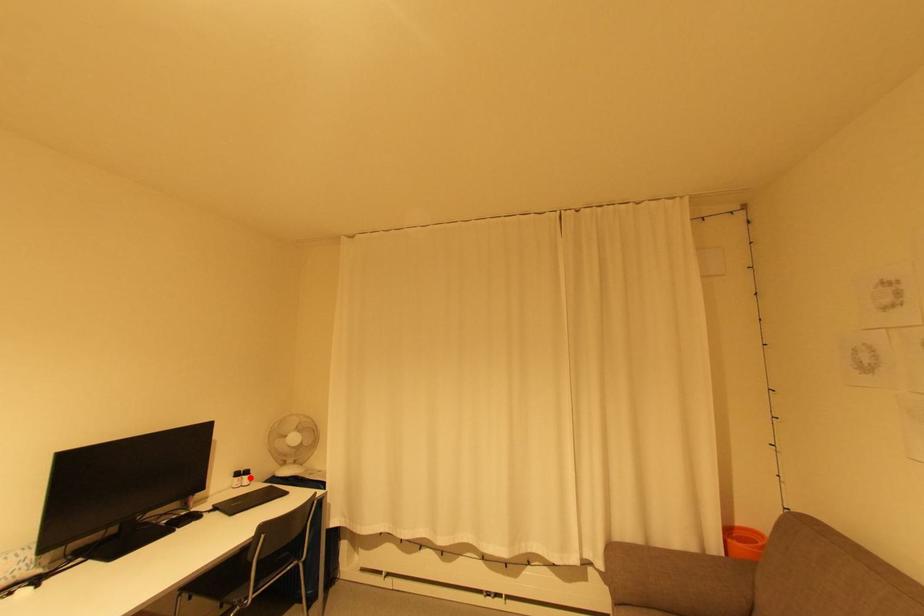
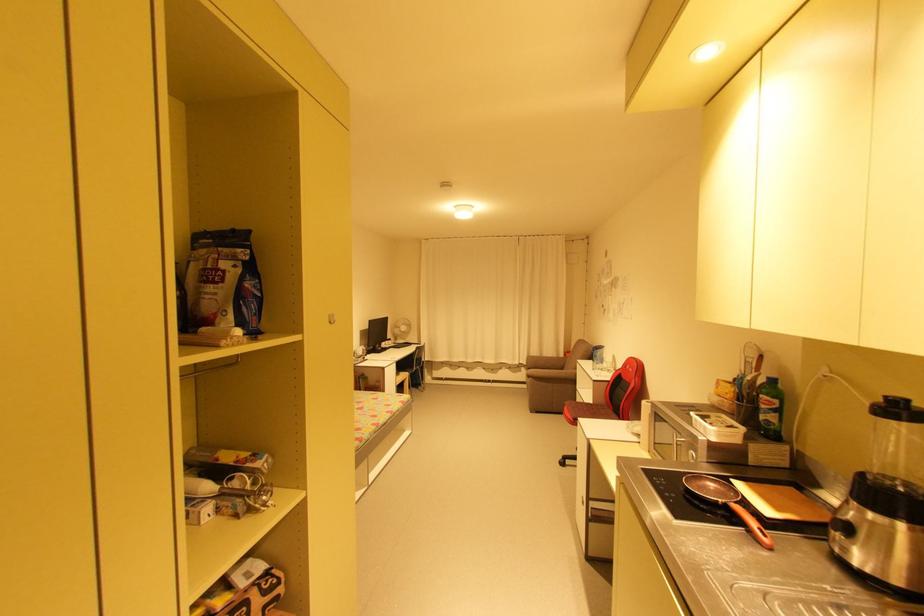
Locate, in the second image, the point that corresponds to the highlighted location in the first image.

(395, 342)